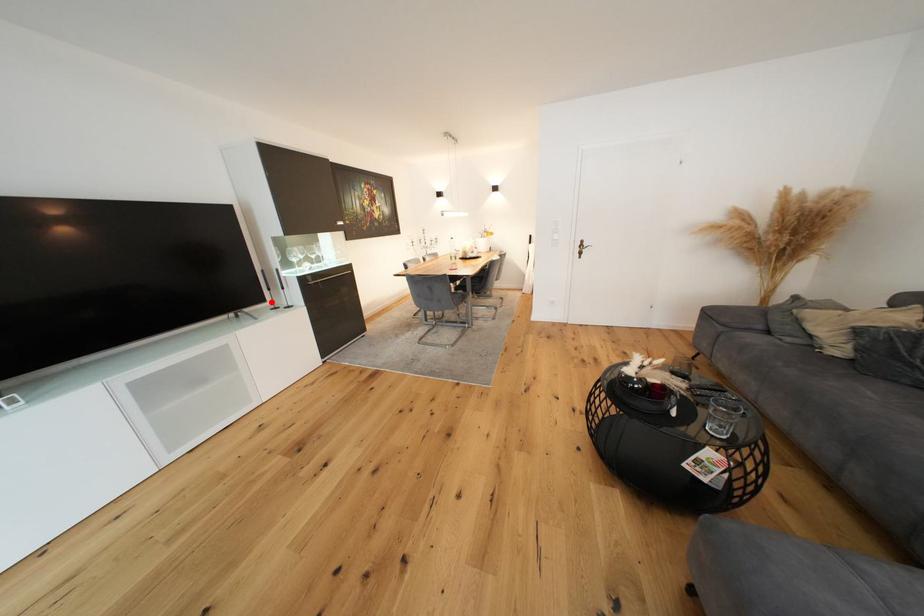
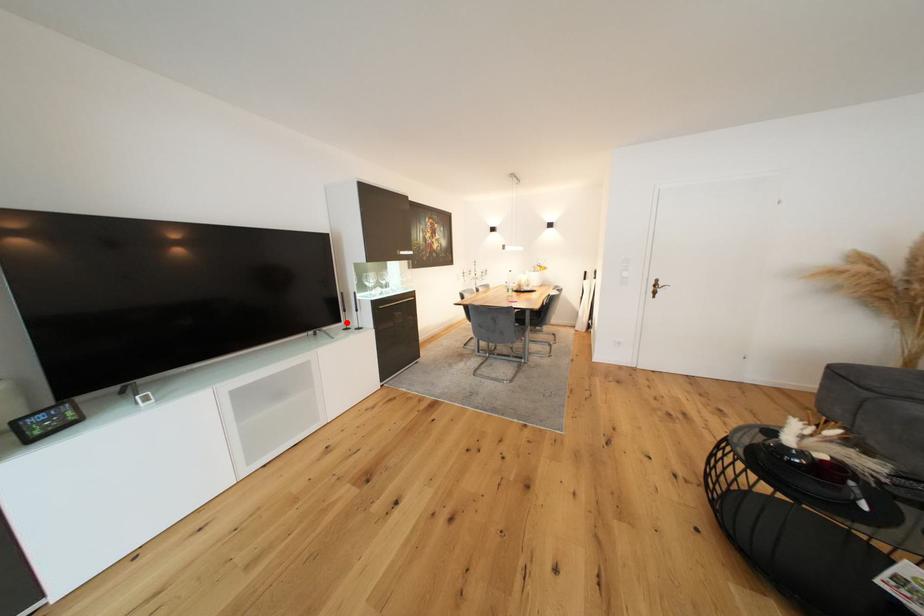
I am providing you with two images of the same scene from different viewpoints. A red point is marked on the first image and another point is marked on the second image. Is the marked point in image1 the same physical position as the marked point in image2?

Yes